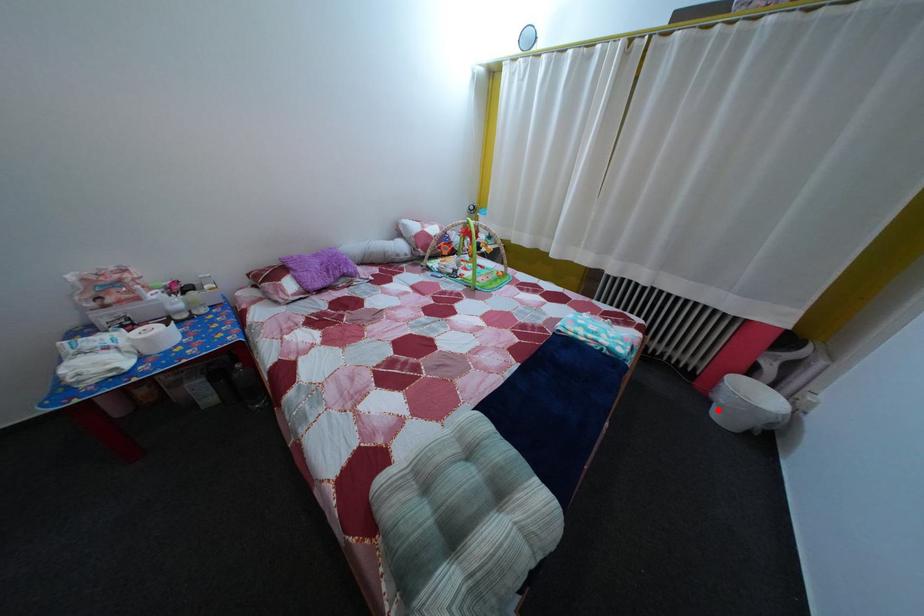
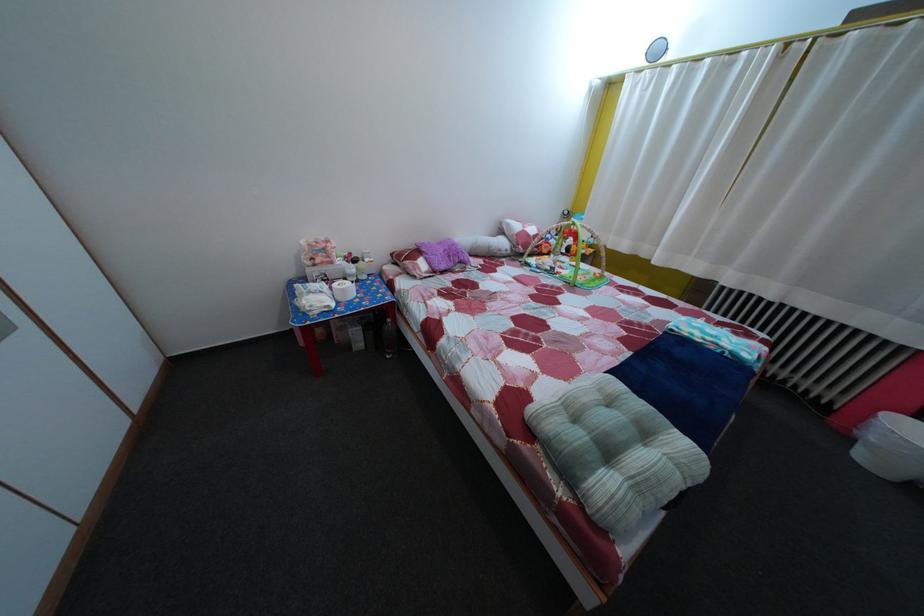
Question: I am providing you with two images of the same scene from different viewpoints. A red point is shown in image1. For the corresponding object point in image2, is it positioned nearer or farther from the camera?

Choices:
 (A) Nearer
 (B) Farther

Answer: (B)